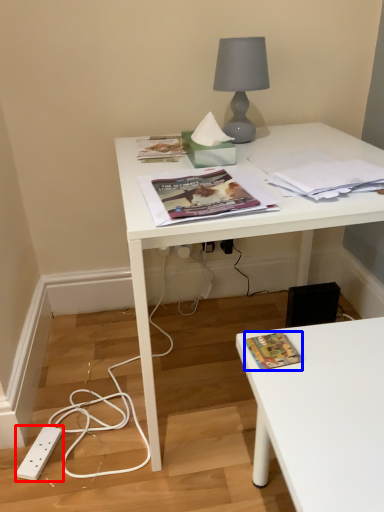
Question: Which object appears farthest to the camera in this image, power plugs and sockets (highlighted by a red box) or book cover (highlighted by a blue box)?

Choices:
 (A) power plugs and sockets
 (B) book cover

Answer: (A)